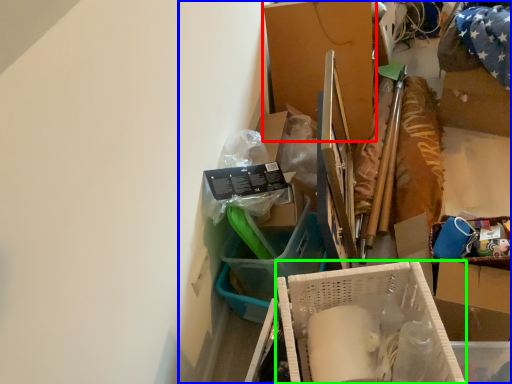
Question: Which is farther away from box (highlighted by a red box)? collection (highlighted by a blue box) or box (highlighted by a green box)?

Choices:
 (A) collection
 (B) box

Answer: (B)